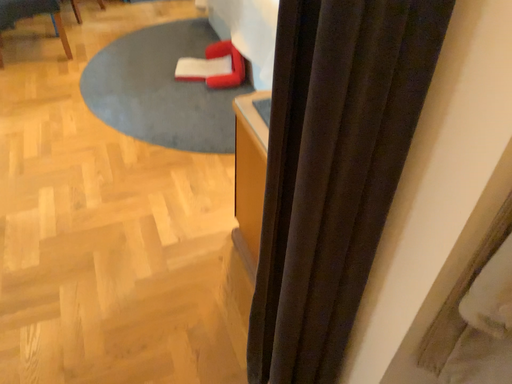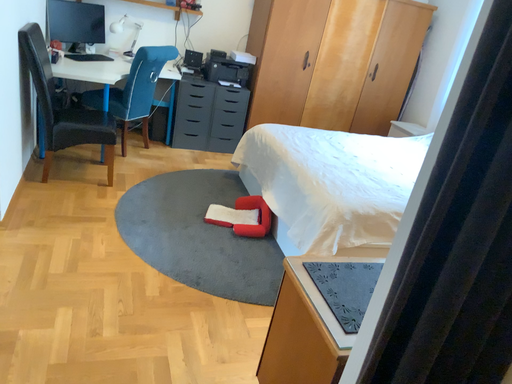
Question: How did the camera likely rotate when shooting the video?

Choices:
 (A) rotated upward
 (B) rotated downward

Answer: (A)